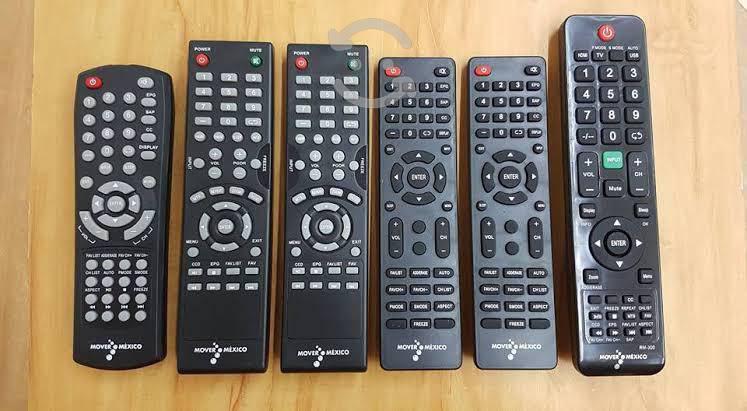
I want to click on tv remotes, so click(130, 209), click(229, 232), click(341, 216), click(447, 216), click(521, 216), click(616, 211).